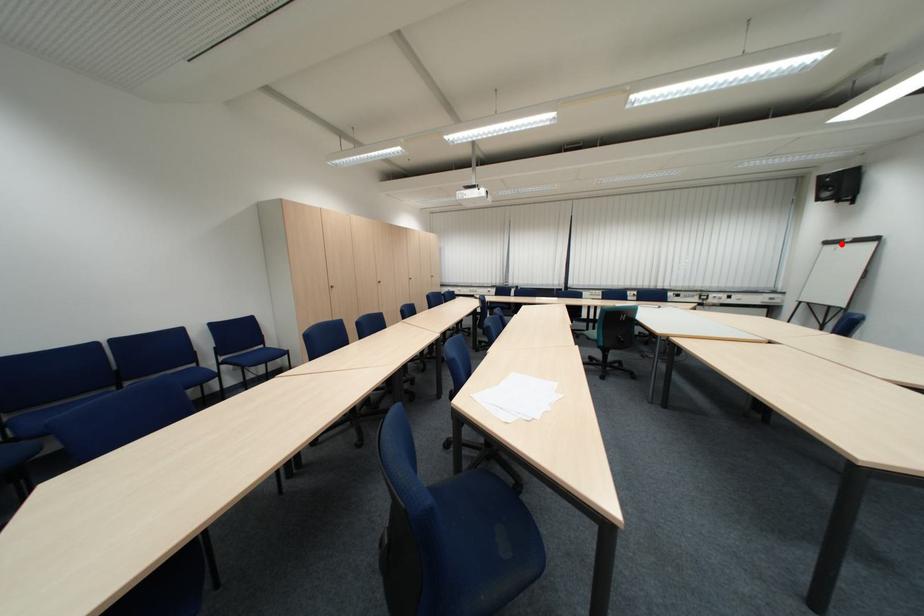
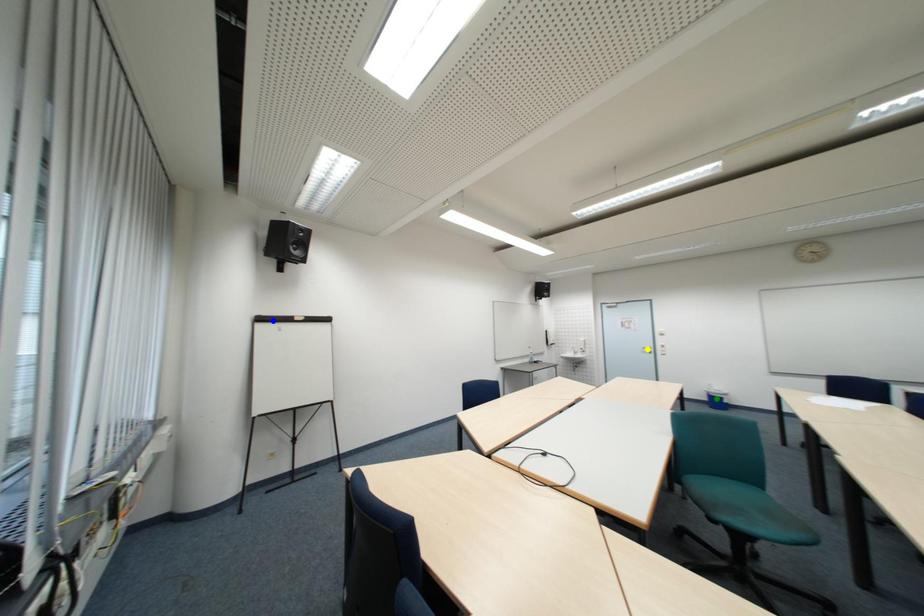
Question: I am providing you with two images of the same scene from different viewpoints. A red point is marked on the first image. You are given multiple points on the second image. Which point in image 2 represents the same 3d spot as the red point in image 1?

Choices:
 (A) blue point
 (B) yellow point
 (C) green point

Answer: (A)